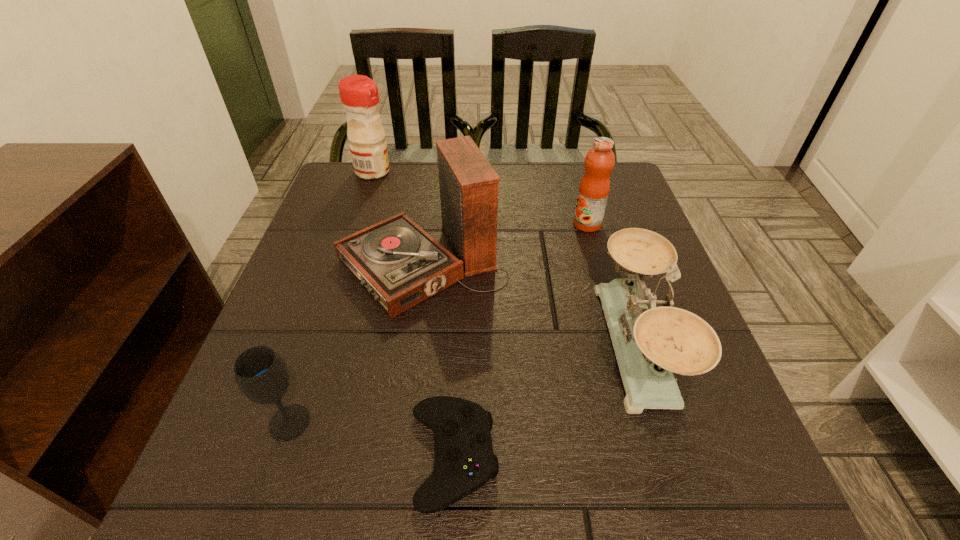
This screenshot has height=540, width=960. I want to click on object that stands as the closest to the wineglass, so click(x=465, y=461).

Find the location of a particular element. This screenshot has height=540, width=960. object that is the fourth closest to the shortest object is located at coordinates (594, 188).

Where is `free space that satisfies the following two spatial constraints: 1. on the front side of the second shortest object; 2. on the left side of the farthest object`? free space that satisfies the following two spatial constraints: 1. on the front side of the second shortest object; 2. on the left side of the farthest object is located at coordinates (290, 422).

I want to click on blank area in the image that satisfies the following two spatial constraints: 1. on the front side of the phonograph record; 2. on the left side of the shortest object, so (396, 456).